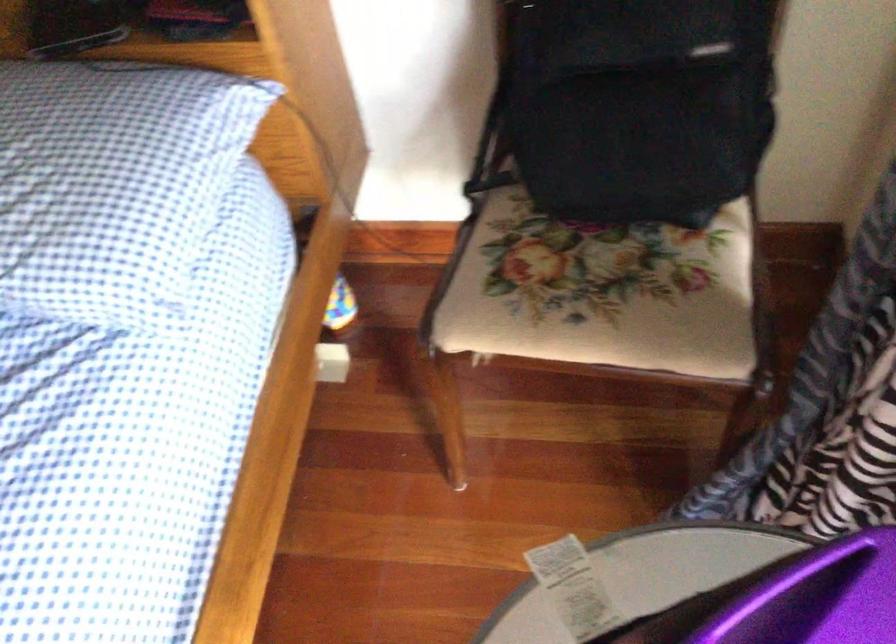
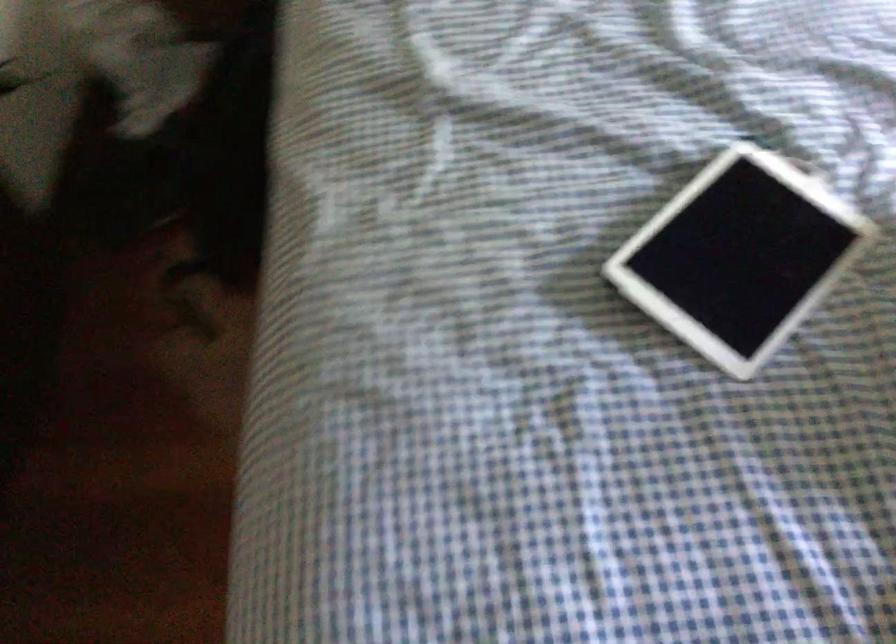
Question: The images are taken continuously from a first-person perspective. In which direction are you moving?

Choices:
 (A) Left
 (B) Right
 (C) Forward
 (D) Backward

Answer: (A)